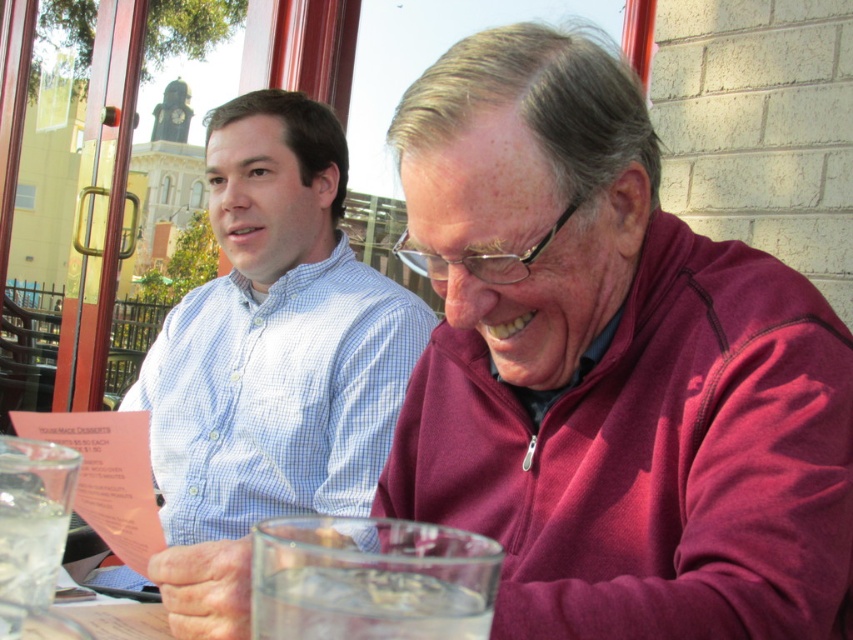
Question: Does light blue checkered shirt at center appear on the left side of clear glass water at lower left?

Choices:
 (A) yes
 (B) no

Answer: (A)

Question: Which point is closer to the camera?

Choices:
 (A) (225, 486)
 (B) (479, 605)

Answer: (B)

Question: Which of the following is the farthest from the observer?

Choices:
 (A) (47, 593)
 (B) (445, 605)
 (C) (253, 260)

Answer: (C)

Question: Does clear glass water at lower center appear under clear glass water at lower left?

Choices:
 (A) yes
 (B) no

Answer: (B)

Question: Which point appears closest to the camera in this image?

Choices:
 (A) pyautogui.click(x=30, y=524)
 (B) pyautogui.click(x=361, y=579)

Answer: (B)

Question: Does light blue checkered shirt at center have a smaller size compared to clear glass water at lower center?

Choices:
 (A) yes
 (B) no

Answer: (B)